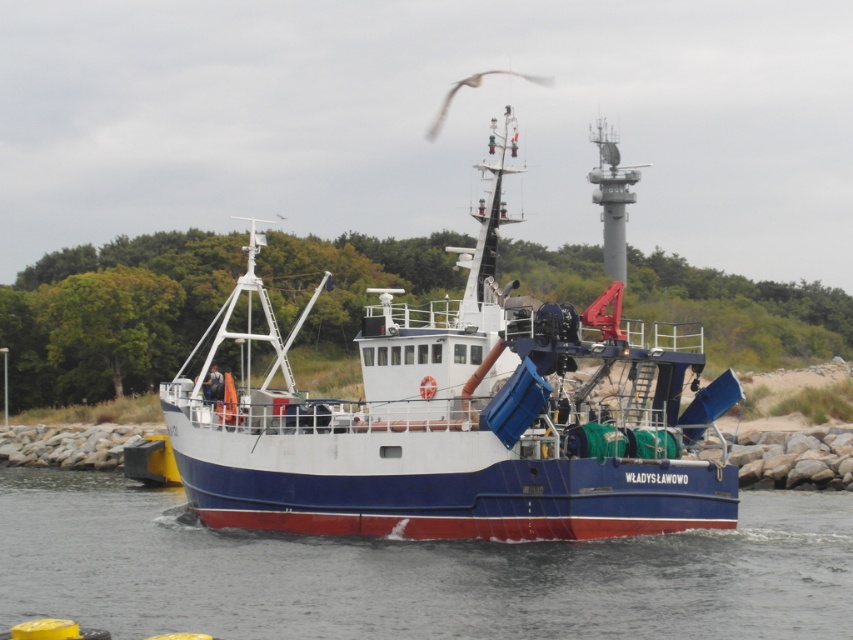
Is blue matte boat at center positioned before blue smooth water at center?

That is False.

Who is more distant from viewer, [498,376] or [265,586]?

Point [498,376]

What are the coordinates of `blue matte boat at center` in the screenshot? It's located at (462, 417).

Who is taller, blue matte boat at center or white feathered bird at upper center?

blue matte boat at center

Is blue matte boat at center to the right of white feathered bird at upper center from the viewer's perspective?

In fact, blue matte boat at center is to the left of white feathered bird at upper center.

This screenshot has width=853, height=640. Identify the location of blue matte boat at center. (462, 417).

Identify the location of blue matte boat at center. The image size is (853, 640). (462, 417).

What do you see at coordinates (412, 572) in the screenshot? I see `blue smooth water at center` at bounding box center [412, 572].

Is blue smooth water at center taller than white feathered bird at upper center?

Incorrect, blue smooth water at center's height is not larger of white feathered bird at upper center's.

Between point (36, 518) and point (450, 96), which one is positioned behind?

Point (450, 96)

Image resolution: width=853 pixels, height=640 pixels. I want to click on blue smooth water at center, so click(x=412, y=572).